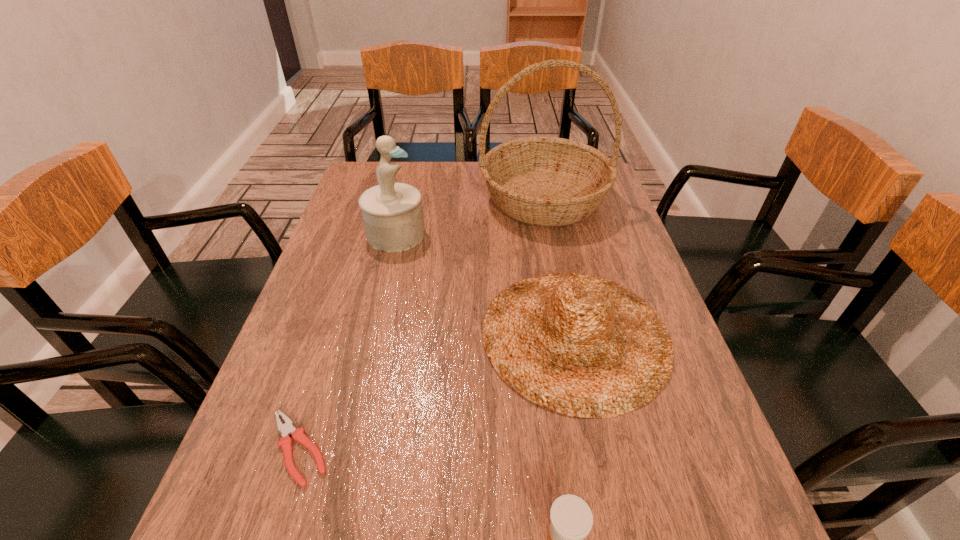
Find the location of a particular element. empty location between the figurine and the sunhat is located at coordinates (486, 285).

Where is `free point between the third tallest object and the shortest object`? Image resolution: width=960 pixels, height=540 pixels. free point between the third tallest object and the shortest object is located at coordinates (437, 392).

Locate an element on the screen. free space between the basket and the sunhat is located at coordinates (560, 267).

Find the location of a particular element. free space that is in between the second tallest object and the sunhat is located at coordinates (486, 285).

This screenshot has height=540, width=960. What are the coordinates of `object that stands as the fourth closest to the fourth tallest object` in the screenshot? It's located at (545, 181).

At what (x,y) coordinates should I click in order to perform the action: click on object that can be found as the third closest to the figurine. Please return your answer as a coordinate pair (x, y). Looking at the image, I should click on (286, 429).

This screenshot has width=960, height=540. In order to click on free space that satisfies the following two spatial constraints: 1. at the beak of the fourth shortest object; 2. on the left side of the sunhat in this screenshot , I will do `click(372, 335)`.

I want to click on free space that satisfies the following two spatial constraints: 1. on the back side of the pliers; 2. on the left side of the basket, so click(x=378, y=199).

This screenshot has width=960, height=540. What are the coordinates of `vacant space that satisfies the following two spatial constraints: 1. at the beak of the sunhat; 2. on the right side of the figurine` in the screenshot? It's located at (372, 335).